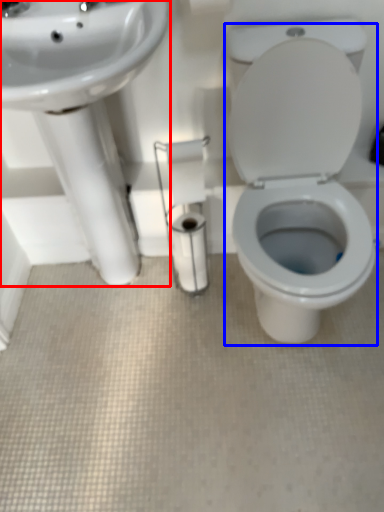
Question: Which of the following is the farthest to the observer, sink (highlighted by a red box) or porcelain (highlighted by a blue box)?

Choices:
 (A) sink
 (B) porcelain

Answer: (A)